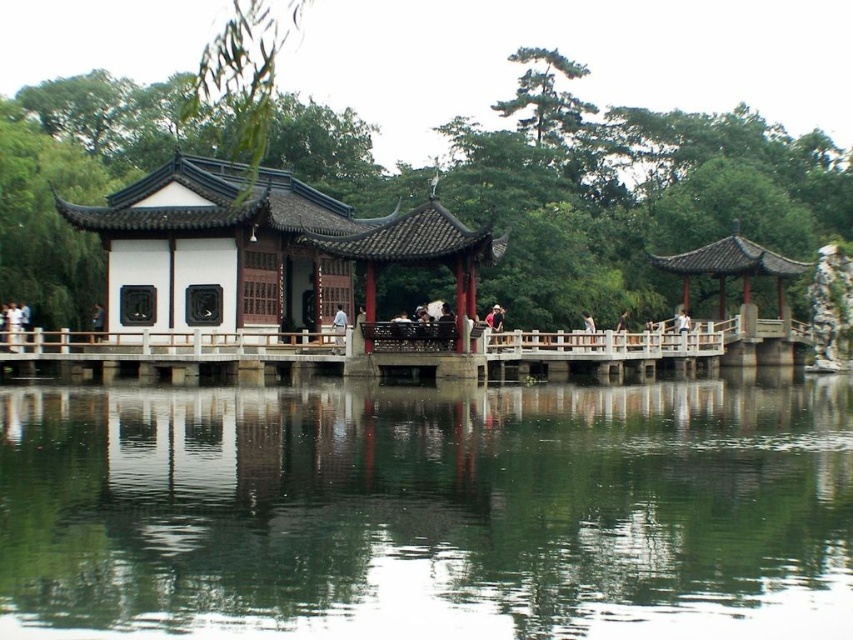
Question: Among these objects, which one is farthest from the camera?

Choices:
 (A) white wooden pavilion at center
 (B) light brown wooden bench at center

Answer: (B)

Question: Can you confirm if green reflective water at center is thinner than white wooden pavilion at center?

Choices:
 (A) no
 (B) yes

Answer: (A)

Question: Which object is closer to the camera taking this photo?

Choices:
 (A) white wooden pavilion at center
 (B) green reflective water at center
 (C) matte black person at center
 (D) light brown wooden bench at center

Answer: (B)

Question: From the image, what is the correct spatial relationship of white wooden pavilion at center in relation to light brown wooden bench at center?

Choices:
 (A) below
 (B) above

Answer: (B)

Question: Is green reflective water at center closer to camera compared to light brown wooden bench at center?

Choices:
 (A) yes
 (B) no

Answer: (A)

Question: Based on their relative distances, which object is farther from the matte black person at center?

Choices:
 (A) white wooden pavilion at center
 (B) light brown wooden bench at center

Answer: (B)